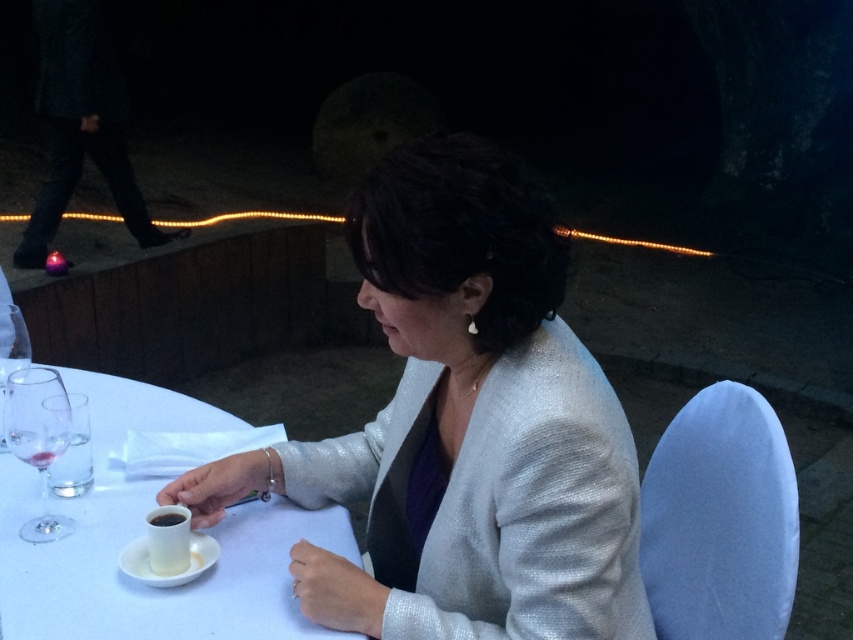
Please describe the position of the transparent glass at left in terms of coordinates relative to the image.

The transparent glass at left is located at coordinates approximately 0.553 on the x axis and 0.013 on the y axis.

You are a waiter at an evening event and need to place a new drink order on the table. The table has a transparent glass at left and a black glossy cup at lower left. Which item has a wider opening to accommodate a straw?

The transparent glass at left has a wider opening than the black glossy cup at lower left, so it can accommodate a straw better.